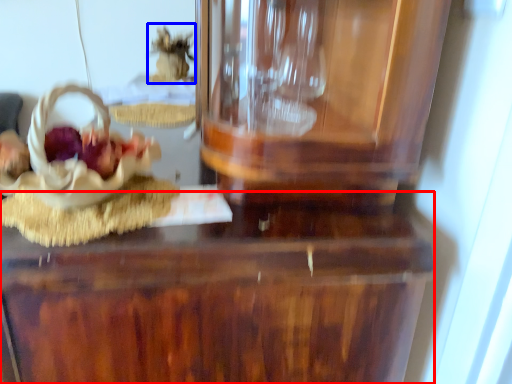
Question: Which of the following is the closest to the observer, table (highlighted by a red box) or stuff (highlighted by a blue box)?

Choices:
 (A) table
 (B) stuff

Answer: (A)